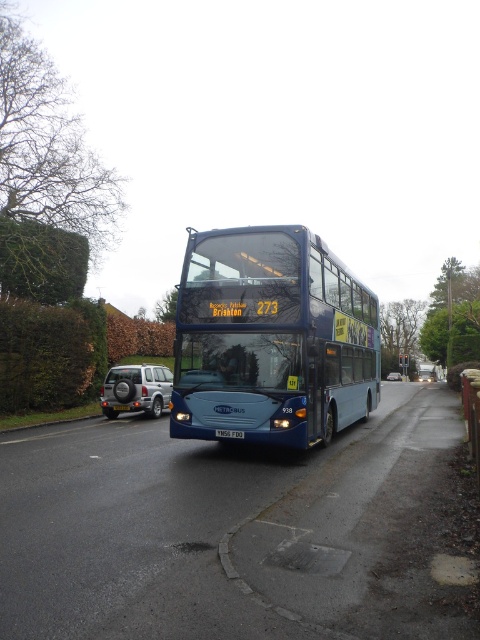
Question: Which point is closer to the camera?

Choices:
 (A) (229, 433)
 (B) (121, 406)
 (C) (59, 349)
 (D) (261, 234)

Answer: (A)

Question: Is blue metallic bus at center closer to camera compared to silver metallic car at center?

Choices:
 (A) no
 (B) yes

Answer: (B)

Question: Which object is the closest to the yellow metallic license plate at center?

Choices:
 (A) silver metallic suv at lower left
 (B) satin silver suv at center
 (C) silver metallic car at center
 (D) blue metallic bus at center

Answer: (D)

Question: Does green leafy hedge at left have a lesser width compared to silver metallic suv at lower left?

Choices:
 (A) yes
 (B) no

Answer: (A)

Question: Is silver metallic suv at lower left bigger than silver metallic car at center?

Choices:
 (A) yes
 (B) no

Answer: (B)

Question: Estimate the real-world distances between objects in this image. Which object is closer to the green leafy hedge at left?

Choices:
 (A) satin silver suv at center
 (B) yellow metallic license plate at center
 (C) silver metallic car at center

Answer: (B)